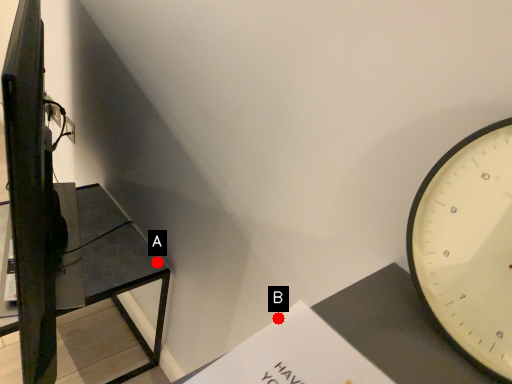
Question: Two points are circled on the image, labeled by A and B beside each circle. Which point is farther to the camera?

Choices:
 (A) A is further
 (B) B is further

Answer: (A)